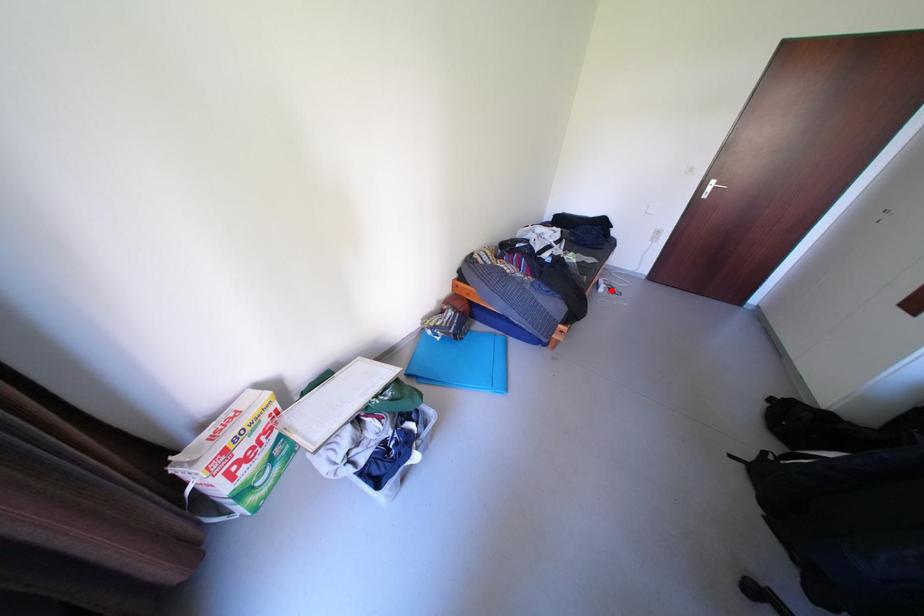
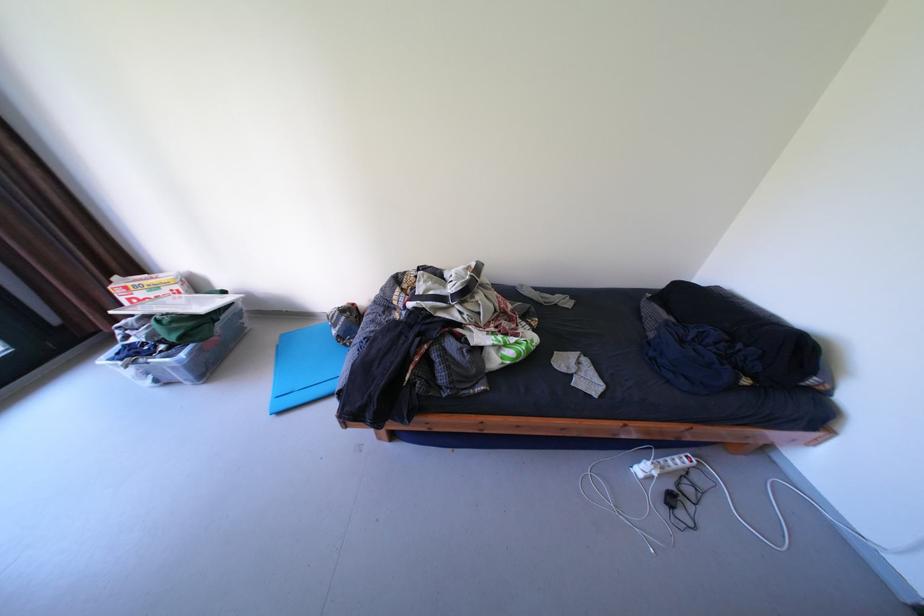
Question: I am providing you with two images of the same scene from different viewpoints. A red point is marked on the first image. At the location where the point appears in image 1, is it still visible in image 2?

Choices:
 (A) Yes
 (B) No

Answer: (A)